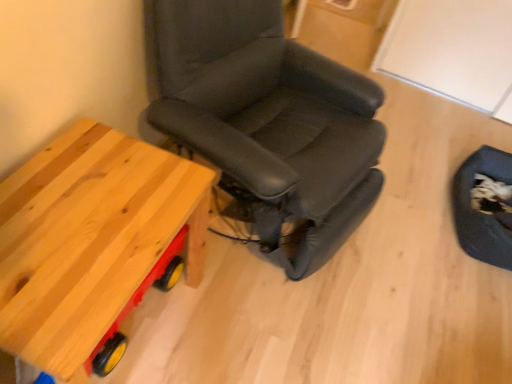
Question: Is natural wood table at left positioned far away from dark blue fabric swivel chair at lower right?

Choices:
 (A) yes
 (B) no

Answer: (A)

Question: Is natural wood table at left taller than dark blue fabric swivel chair at lower right?

Choices:
 (A) no
 (B) yes

Answer: (B)

Question: Does natural wood table at left have a greater width compared to dark blue fabric swivel chair at lower right?

Choices:
 (A) yes
 (B) no

Answer: (A)

Question: From a real-world perspective, is natural wood table at left under dark blue fabric swivel chair at lower right?

Choices:
 (A) yes
 (B) no

Answer: (B)

Question: From the image's perspective, would you say natural wood table at left is shown under dark blue fabric swivel chair at lower right?

Choices:
 (A) yes
 (B) no

Answer: (A)

Question: Is dark blue fabric swivel chair at lower right inside natural wood table at left?

Choices:
 (A) yes
 (B) no

Answer: (B)

Question: Is the position of black leather chair at center less distant than that of dark blue fabric swivel chair at lower right?

Choices:
 (A) no
 (B) yes

Answer: (B)

Question: Would you say black leather chair at center contains dark blue fabric swivel chair at lower right?

Choices:
 (A) yes
 (B) no

Answer: (B)

Question: Does black leather chair at center have a lesser width compared to dark blue fabric swivel chair at lower right?

Choices:
 (A) yes
 (B) no

Answer: (B)

Question: Is black leather chair at center positioned behind dark blue fabric swivel chair at lower right?

Choices:
 (A) no
 (B) yes

Answer: (A)

Question: From a real-world perspective, does black leather chair at center stand above dark blue fabric swivel chair at lower right?

Choices:
 (A) yes
 (B) no

Answer: (A)

Question: Could you tell me if black leather chair at center is facing dark blue fabric swivel chair at lower right?

Choices:
 (A) no
 (B) yes

Answer: (A)

Question: Considering the relative sizes of dark blue fabric swivel chair at lower right and black leather chair at center in the image provided, is dark blue fabric swivel chair at lower right shorter than black leather chair at center?

Choices:
 (A) yes
 (B) no

Answer: (A)